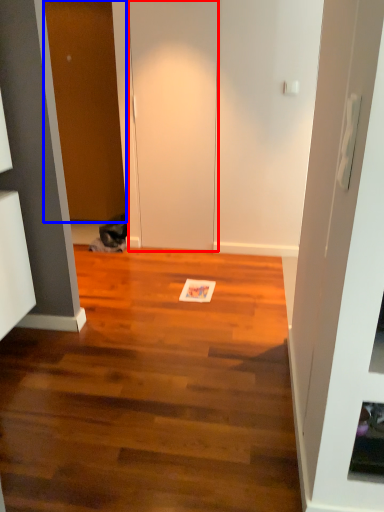
Question: Which object is further to the camera taking this photo, door (highlighted by a red box) or door (highlighted by a blue box)?

Choices:
 (A) door
 (B) door

Answer: (B)